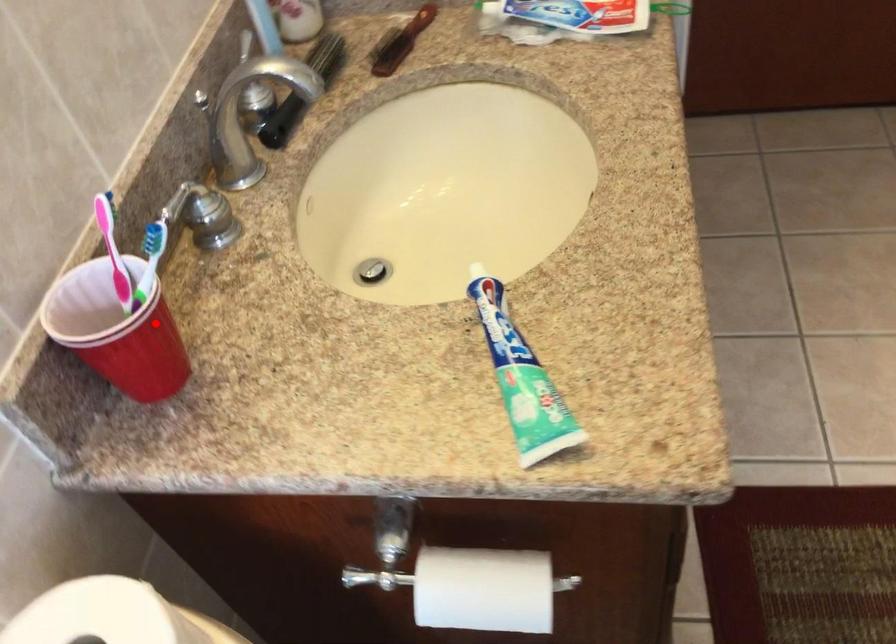
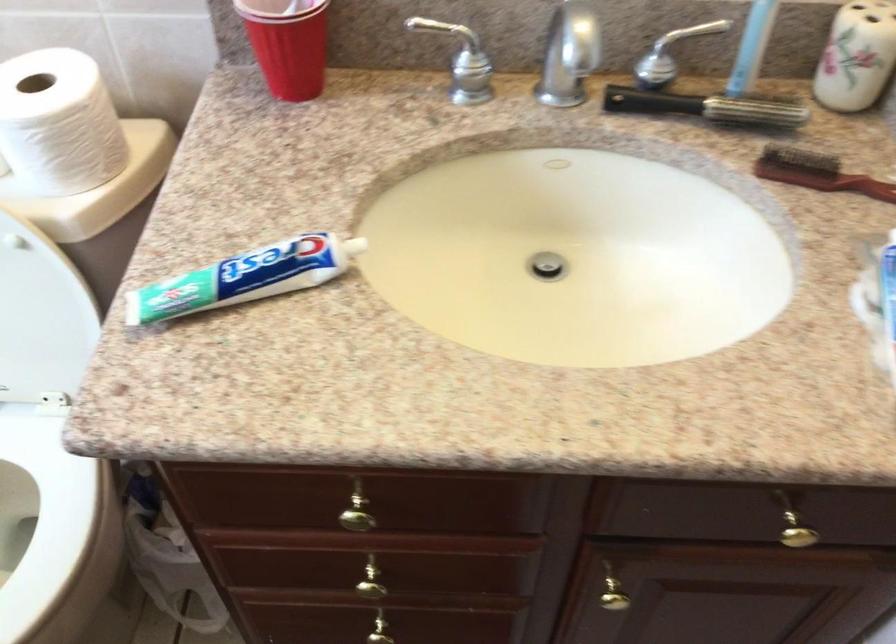
Question: I am providing you with two images of the same scene from different viewpoints. In image1, a red point is highlighted. Considering the same 3D point in image2, which of the following is correct?

Choices:
 (A) It is closer
 (B) It is farther

Answer: (B)